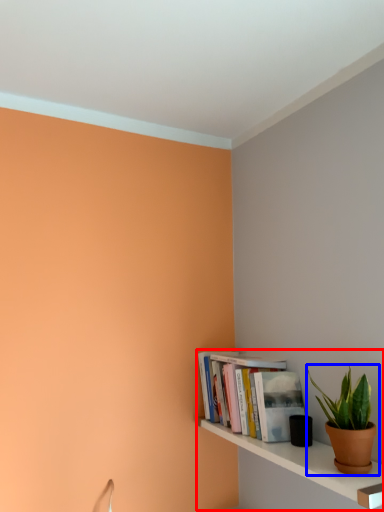
Question: Among these objects, which one is nearest to the camera, shelf (highlighted by a red box) or houseplant (highlighted by a blue box)?

Choices:
 (A) shelf
 (B) houseplant

Answer: (A)